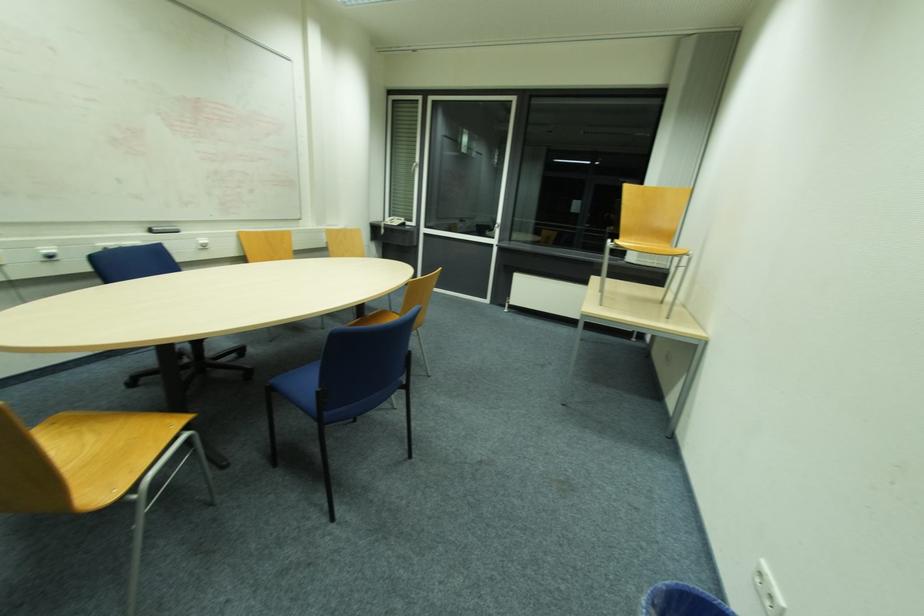
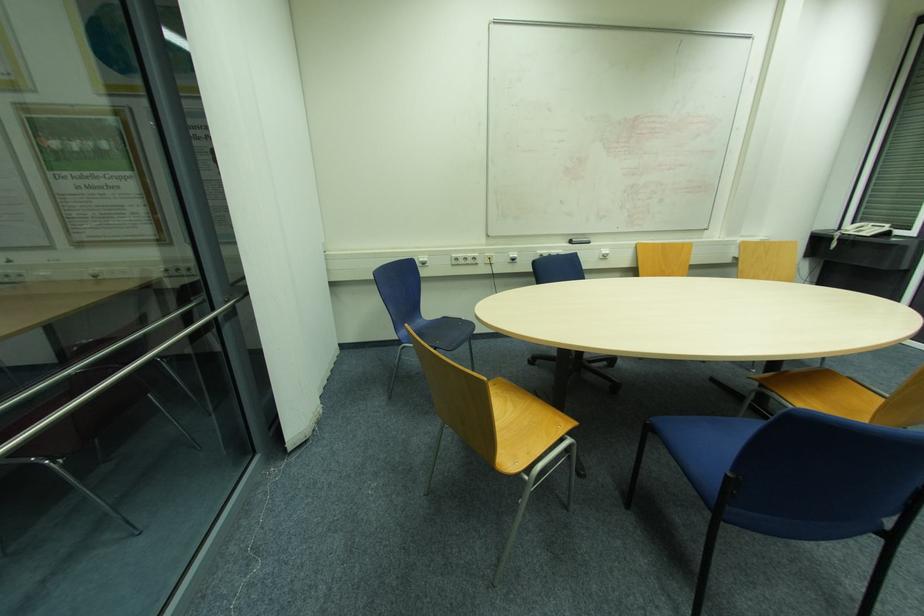
Where in the second image is the point corresponding to point 91,439 from the first image?

(511, 407)